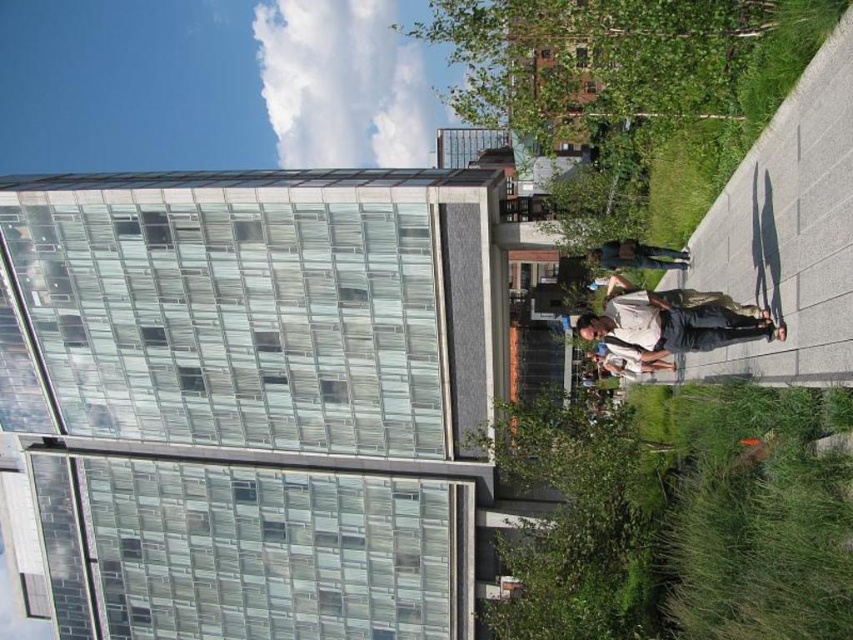
You are standing on the paved walkway and see the dark blue jeans at center and the white cotton shirt at center. Which clothing item is higher up from the ground?

The dark blue jeans at center is located above the white cotton shirt at center, so the dark blue jeans at center is higher up from the ground.

You are standing on the walkway and see a person wearing a white cotton shirt at center and dark blue jeans at center. Which piece of clothing is positioned to the right side of the other?

The dark blue jeans at center are to the right of the white cotton shirt at center.